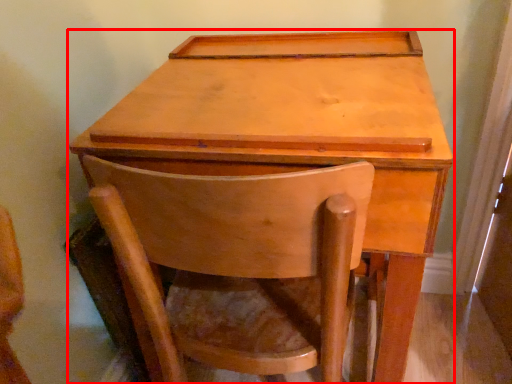
Question: Observing the image, what is the correct spatial positioning of table (annotated by the red box) in reference to chair?

Choices:
 (A) right
 (B) left

Answer: (A)